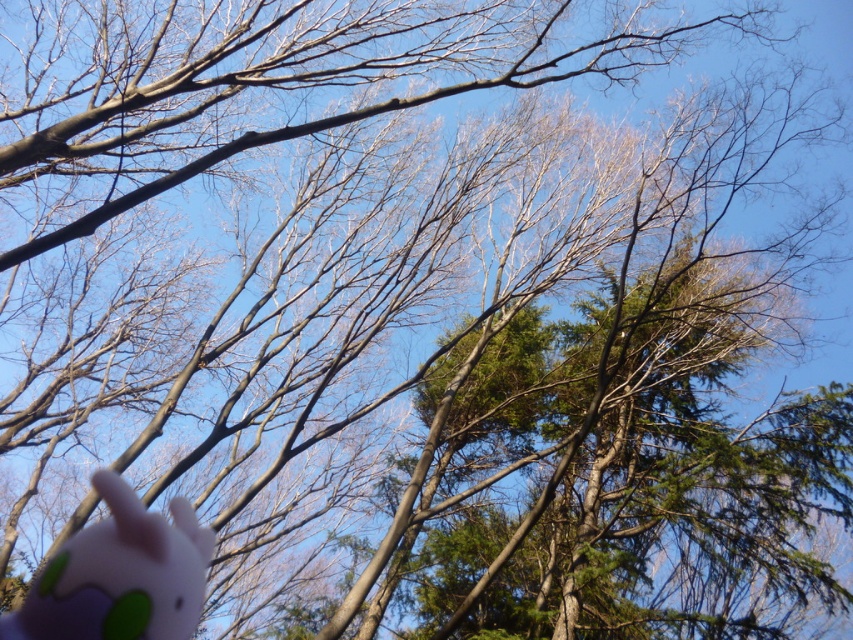
You are a squirrel perched on a branch in a tree. You spot a pink rubber toy at lower left and a brown matte branch at upper center. Which object is farther away from you?

The brown matte branch at upper center is farther away from the pink rubber toy at lower left by 12.09 feet, so the brown matte branch at upper center is farther away.

You are observing the tree branches in the image. There is a brown matte branch at upper center. Can you determine its position relative to the center of the image?

The brown matte branch at upper center is located at point coordinates approximately 0.122 on the horizontal axis and 0.320 on the vertical axis, placing it slightly to the left and above the center of the image.